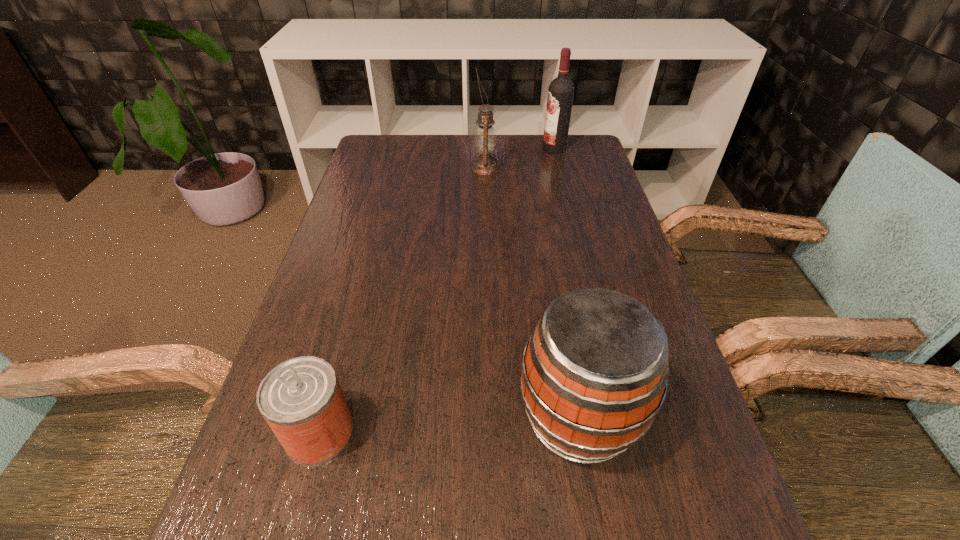
At what (x,y) coordinates should I click in order to perform the action: click on the third closest object to the shortest object. Please return your answer as a coordinate pair (x, y). The width and height of the screenshot is (960, 540). Looking at the image, I should click on (561, 90).

The image size is (960, 540). What are the coordinates of `vacant space that satisfies the following two spatial constraints: 1. on the back side of the cider; 2. on the left side of the can` in the screenshot? It's located at (324, 416).

Where is `vacant space that satisfies the following two spatial constraints: 1. on the label of the farthest object; 2. on the front side of the can`? The height and width of the screenshot is (540, 960). vacant space that satisfies the following two spatial constraints: 1. on the label of the farthest object; 2. on the front side of the can is located at coordinates (625, 433).

This screenshot has height=540, width=960. Find the location of `vacant space that satisfies the following two spatial constraints: 1. on the front side of the third tallest object; 2. on the right side of the second object from left to right`. vacant space that satisfies the following two spatial constraints: 1. on the front side of the third tallest object; 2. on the right side of the second object from left to right is located at coordinates (490, 416).